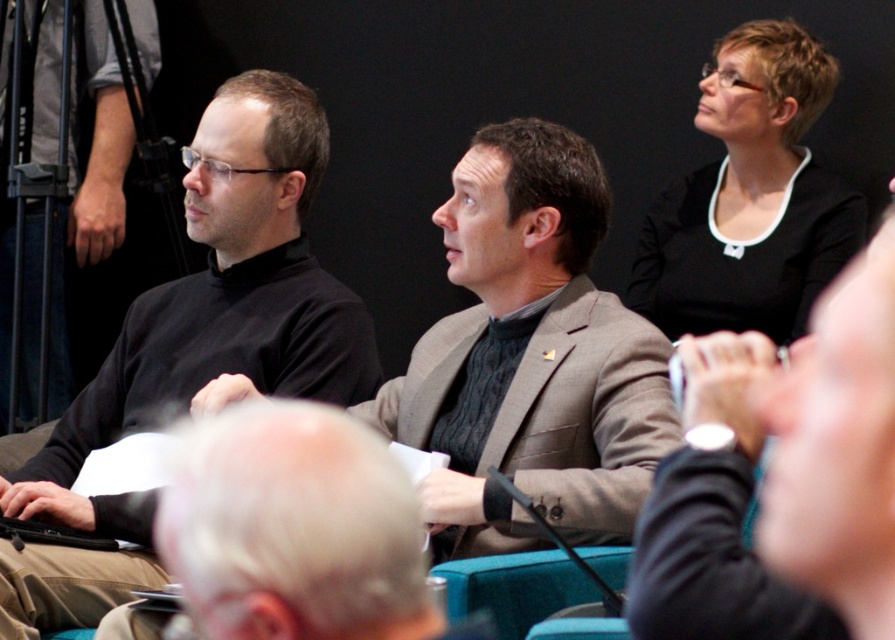
Between point (376, 401) and point (833, 307), which one is positioned behind?

The point (376, 401) is behind.

Is black turtleneck sweater at center to the left of black jersey at upper right from the viewer's perspective?

Yes, black turtleneck sweater at center is to the left of black jersey at upper right.

Does point (606, 189) lie behind point (819, 388)?

Yes, point (606, 189) is farther from viewer.

At what (x,y) coordinates should I click in order to perform the action: click on black turtleneck sweater at center. Please return your answer as a coordinate pair (x, y). The height and width of the screenshot is (640, 895). Looking at the image, I should click on (530, 356).

Between black matte turtleneck sweater at left and black jersey at upper right, which one has more height?

Standing taller between the two is black matte turtleneck sweater at left.

Can you confirm if black matte turtleneck sweater at left is positioned to the left of black jersey at upper right?

Correct, you'll find black matte turtleneck sweater at left to the left of black jersey at upper right.

Who is more forward, (100, 384) or (736, 355)?

Point (736, 355) is in front.

Locate an element on the screen. This screenshot has height=640, width=895. black matte turtleneck sweater at left is located at coordinates (195, 346).

Image resolution: width=895 pixels, height=640 pixels. What do you see at coordinates (195, 346) in the screenshot?
I see `black matte turtleneck sweater at left` at bounding box center [195, 346].

Which of these two, black matte turtleneck sweater at left or black matte shirt at upper right, stands shorter?

black matte shirt at upper right

This screenshot has width=895, height=640. I want to click on black matte turtleneck sweater at left, so click(x=195, y=346).